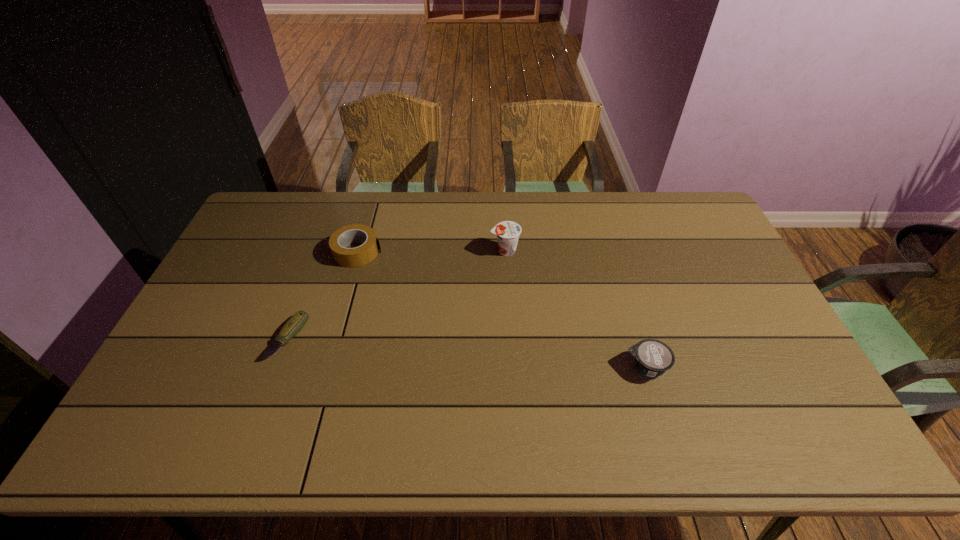
Where is `vacant point located between the right yogurt and the duct tape`? The height and width of the screenshot is (540, 960). vacant point located between the right yogurt and the duct tape is located at coordinates (502, 309).

Find the location of `unoccupied area between the tallest object and the duct tape`. unoccupied area between the tallest object and the duct tape is located at coordinates (431, 251).

Identify the location of vacant space in between the shortest object and the duct tape. click(x=323, y=295).

You are a GUI agent. You are given a task and a screenshot of the screen. Output one action in this format:
    pyautogui.click(x=<x>, y=<y>)
    Task: Click on the empty space between the farther yogurt and the rightmost object
    
    Given the screenshot: What is the action you would take?
    pyautogui.click(x=576, y=309)

Locate an element on the screen. The image size is (960, 540). vacant area that lies between the taller yogurt and the leftmost object is located at coordinates (396, 294).

This screenshot has height=540, width=960. In order to click on unoccupied area between the third object from right to left and the nearer yogurt in this screenshot , I will do `click(502, 309)`.

Identify which object is the third closest to the pocketknife. Please provide its 2D coordinates. Your answer should be formatted as a tuple, i.e. [(x, y)], where the tuple contains the x and y coordinates of a point satisfying the conditions above.

[(652, 357)]

The image size is (960, 540). Identify the location of object that is the closest one to the leftmost object. (359, 256).

Identify the location of vacant space that satisfies the following two spatial constraints: 1. on the back side of the rightmost object; 2. at the edge of the second object from left to right. (612, 252).

Identify the location of vacant region that satisfies the following two spatial constraints: 1. on the back side of the leftmost object; 2. on the right side of the left yogurt. (320, 251).